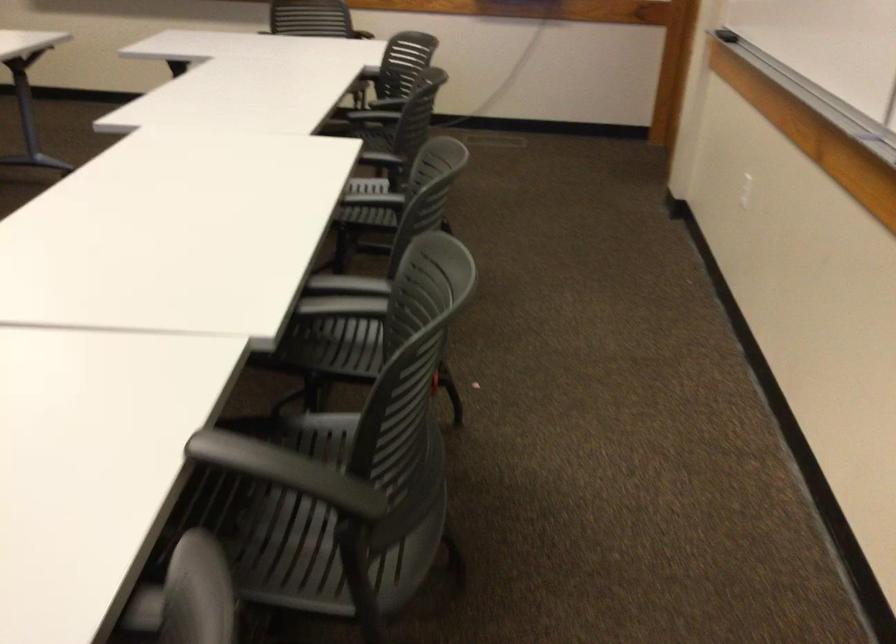
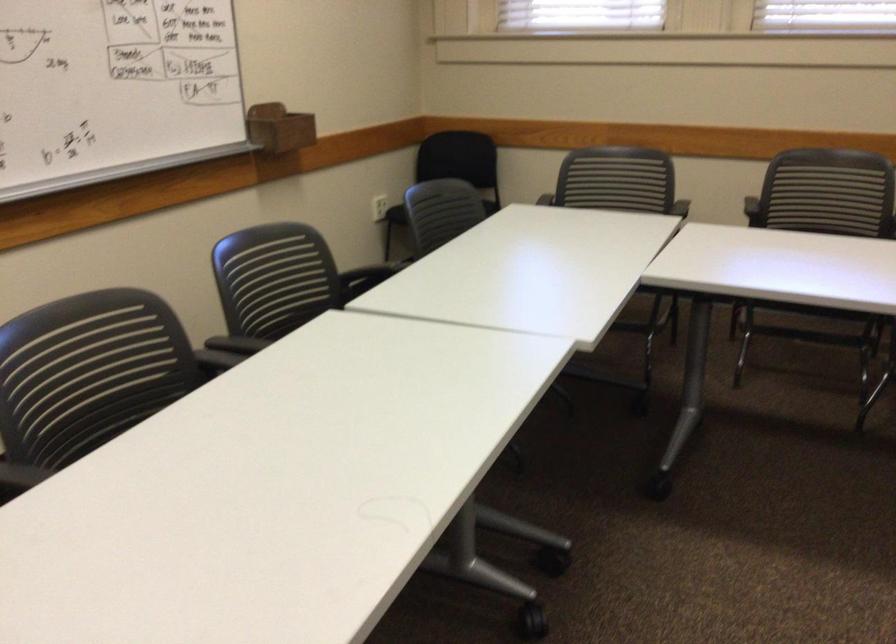
Question: I am providing you with two images of the same scene from different viewpoints. After the viewpoint changes to image2, which objects are now occluded?

Choices:
 (A) black chair sitting surface
 (B) wooden marker holder
 (C) spoon
 (D) chair sitting surface

Answer: (A)